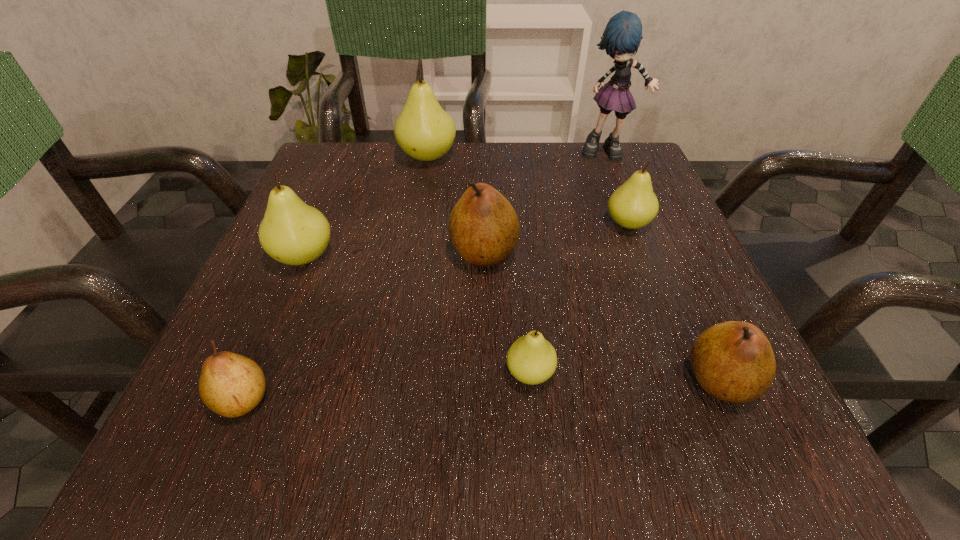
Locate an element on the screen. vacant area in the image that satisfies the following two spatial constraints: 1. on the back side of the second green pear from left to right; 2. on the left side of the smallest brown pear is located at coordinates (345, 157).

Identify the location of vacant region that satisfies the following two spatial constraints: 1. on the back side of the smallest brown pear; 2. on the left side of the leftmost green pear. Image resolution: width=960 pixels, height=540 pixels. (302, 257).